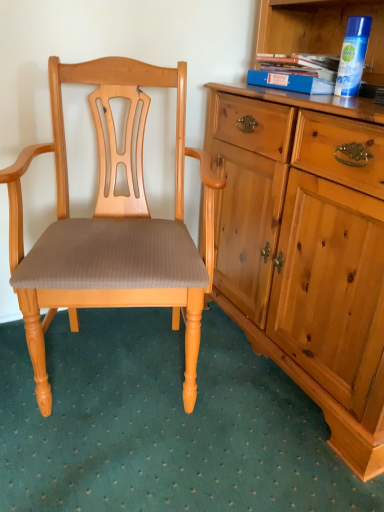
Describe the element at coordinates (112, 226) in the screenshot. The width and height of the screenshot is (384, 512). I see `matte wood chair at center` at that location.

Where is `matte wood chair at center`? The height and width of the screenshot is (512, 384). matte wood chair at center is located at coordinates (112, 226).

Image resolution: width=384 pixels, height=512 pixels. Identify the location of blue hardcover book at upper right. (296, 72).

Measure the distance between point (293,89) and camera.

Point (293,89) is 4.15 feet from camera.

Describe the element at coordinates (296, 72) in the screenshot. I see `blue hardcover book at upper right` at that location.

Image resolution: width=384 pixels, height=512 pixels. I want to click on matte wood chair at center, so click(x=112, y=226).

Which object is positioned more to the left, matte wood chair at center or blue hardcover book at upper right?

Positioned to the left is matte wood chair at center.

Which object is more forward, matte wood chair at center or blue hardcover book at upper right?

matte wood chair at center is more forward.

Does point (175, 302) appear closer or farther from the camera than point (313, 59)?

Clearly, point (175, 302) is closer to the camera than point (313, 59).

From the image's perspective, is matte wood chair at center located above or below blue hardcover book at upper right?

Based on their image positions, matte wood chair at center is located beneath blue hardcover book at upper right.

From a real-world perspective, is matte wood chair at center physically located above or below blue hardcover book at upper right?

matte wood chair at center is below blue hardcover book at upper right.

Is matte wood chair at center thinner than blue hardcover book at upper right?

No, matte wood chair at center is not thinner than blue hardcover book at upper right.

Is matte wood chair at center taller than blue hardcover book at upper right?

Indeed, matte wood chair at center has a greater height compared to blue hardcover book at upper right.

Can you confirm if matte wood chair at center is bigger than blue hardcover book at upper right?

Yes.

Could blue hardcover book at upper right be considered to be inside matte wood chair at center?

No, blue hardcover book at upper right is located outside of matte wood chair at center.

Would you say matte wood chair at center is a long distance from blue hardcover book at upper right?

No, matte wood chair at center is not far from blue hardcover book at upper right.

Is matte wood chair at center facing away from blue hardcover book at upper right?

No, blue hardcover book at upper right is not at the back of matte wood chair at center.

How many degrees apart are the facing directions of matte wood chair at center and blue hardcover book at upper right?

There is a 68.4-degree angle between the facing directions of matte wood chair at center and blue hardcover book at upper right.

How far apart are matte wood chair at center and blue hardcover book at upper right?

A distance of 21.50 inches exists between matte wood chair at center and blue hardcover book at upper right.

I want to click on book that appears behind the matte wood chair at center, so click(x=296, y=72).

Is blue hardcover book at upper right at the left side of matte wood chair at center?

Incorrect, blue hardcover book at upper right is not on the left side of matte wood chair at center.

Considering the relative positions of blue hardcover book at upper right and matte wood chair at center in the image provided, is blue hardcover book at upper right behind matte wood chair at center?

Yes, it is.

Is point (312, 87) more distant than point (48, 394)?

Yes, point (312, 87) is farther from viewer.

From the image's perspective, is blue hardcover book at upper right on matte wood chair at center?

Yes.

From a real-world perspective, is blue hardcover book at upper right on matte wood chair at center?

Correct, in the physical world, blue hardcover book at upper right is higher than matte wood chair at center.

Consider the image. In terms of width, does blue hardcover book at upper right look wider or thinner when compared to matte wood chair at center?

Considering their sizes, blue hardcover book at upper right looks slimmer than matte wood chair at center.

In terms of height, does blue hardcover book at upper right look taller or shorter compared to matte wood chair at center?

In the image, blue hardcover book at upper right appears to be shorter than matte wood chair at center.

Considering the sizes of objects blue hardcover book at upper right and matte wood chair at center in the image provided, who is smaller, blue hardcover book at upper right or matte wood chair at center?

blue hardcover book at upper right.

Is blue hardcover book at upper right not inside matte wood chair at center?

Yes, blue hardcover book at upper right is not within matte wood chair at center.

Is blue hardcover book at upper right far away from matte wood chair at center?

blue hardcover book at upper right is actually quite close to matte wood chair at center.

Is blue hardcover book at upper right positioned with its back to matte wood chair at center?

No, matte wood chair at center is not at the back of blue hardcover book at upper right.

Where is `chair on the left of blue hardcover book at upper right`? chair on the left of blue hardcover book at upper right is located at coordinates 112,226.

You are a GUI agent. You are given a task and a screenshot of the screen. Output one action in this format:
    pyautogui.click(x=<x>, y=<y>)
    Task: Click on the chair below the blue hardcover book at upper right (from a real-world perspective)
    The image size is (384, 512).
    Given the screenshot: What is the action you would take?
    pyautogui.click(x=112, y=226)

I want to click on book behind the matte wood chair at center, so click(296, 72).